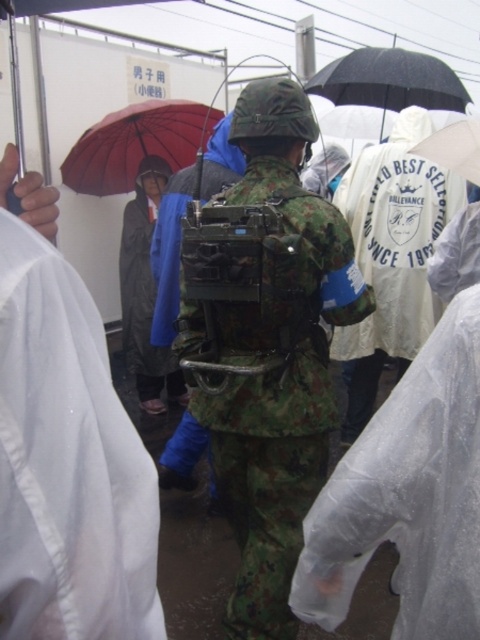
Image resolution: width=480 pixels, height=640 pixels. What do you see at coordinates (265, 344) in the screenshot?
I see `camouflage fabric backpack at center` at bounding box center [265, 344].

Can you confirm if camouflage fabric backpack at center is wider than white matte umbrella at upper center?

Yes.

Is point (289, 208) positioned after point (460, 170)?

No, it is in front of (460, 170).

The height and width of the screenshot is (640, 480). What are the coordinates of `camouflage fabric backpack at center` in the screenshot? It's located at (265, 344).

From the picture: Who is shorter, camouflage fabric backpack at center or black matte umbrella at upper center?

black matte umbrella at upper center

This screenshot has height=640, width=480. Identify the location of camouflage fabric backpack at center. (265, 344).

At what (x,y) coordinates should I click in order to perform the action: click on camouflage fabric backpack at center. Please return your answer as a coordinate pair (x, y). Image resolution: width=480 pixels, height=640 pixels. Looking at the image, I should click on (265, 344).

Between point (227, 513) and point (121, 120), which one is positioned behind?

Point (121, 120)

Looking at this image, is camouflage fabric backpack at center bigger than red matte umbrella at upper left?

Incorrect, camouflage fabric backpack at center is not larger than red matte umbrella at upper left.

Is point (245, 552) less distant than point (208, 132)?

Yes, it is.

You are a GUI agent. You are given a task and a screenshot of the screen. Output one action in this format:
    pyautogui.click(x=<x>, y=<y>)
    Task: Click on the camouflage fabric backpack at center
    This screenshot has width=480, height=640.
    Given the screenshot: What is the action you would take?
    pyautogui.click(x=265, y=344)